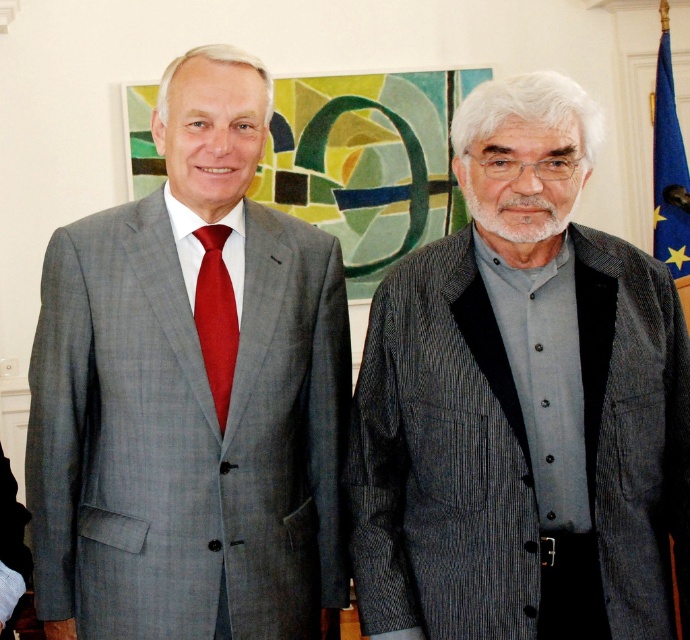
Is matte gray suit at left in front of matte red tie at left?

Yes, matte gray suit at left is closer to the viewer.

Does matte gray suit at left have a lesser height compared to matte red tie at left?

Incorrect, matte gray suit at left's height does not fall short of matte red tie at left's.

Which is behind, point (61, 316) or point (228, 298)?

The point (228, 298) is behind.

I want to click on matte gray suit at left, so click(190, 392).

How distant is gray striped blazer at center from matte gray suit at left?

The distance of gray striped blazer at center from matte gray suit at left is 17.40 inches.

Between gray striped blazer at center and matte gray suit at left, which one appears on the left side from the viewer's perspective?

Positioned to the left is matte gray suit at left.

I want to click on gray striped blazer at center, so click(522, 403).

At what (x,y) coordinates should I click in order to perform the action: click on gray striped blazer at center. Please return your answer as a coordinate pair (x, y). Image resolution: width=690 pixels, height=640 pixels. Looking at the image, I should click on (522, 403).

Looking at this image, who is more distant from viewer, (x=658, y=474) or (x=676, y=186)?

Point (x=676, y=186)

Is point (542, 152) more distant than point (658, 253)?

That is False.

Identify the location of gray striped blazer at center. (522, 403).